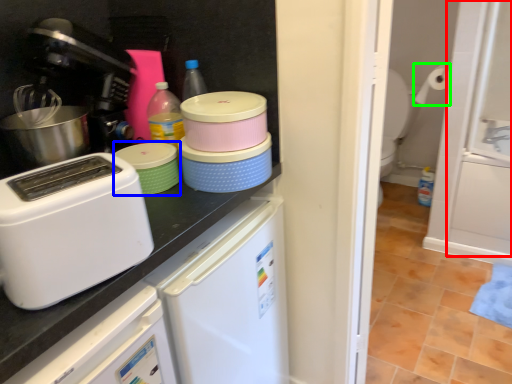
Question: Considering the real-world distances, which object is farthest from screen door (highlighted by a red box)? appliance (highlighted by a blue box) or toilet paper (highlighted by a green box)?

Choices:
 (A) appliance
 (B) toilet paper

Answer: (A)